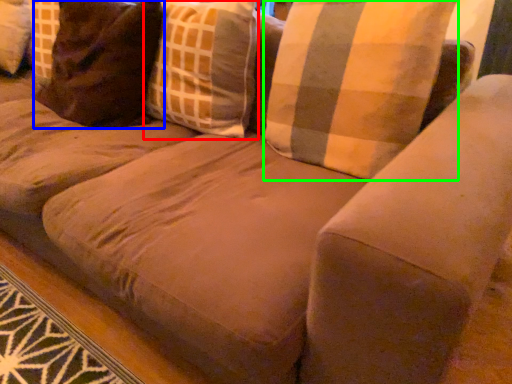
Question: Considering the real-world distances, which object is closest to throw pillow (highlighted by a red box)? pillow (highlighted by a blue box) or pillow (highlighted by a green box).

Choices:
 (A) pillow
 (B) pillow

Answer: (A)